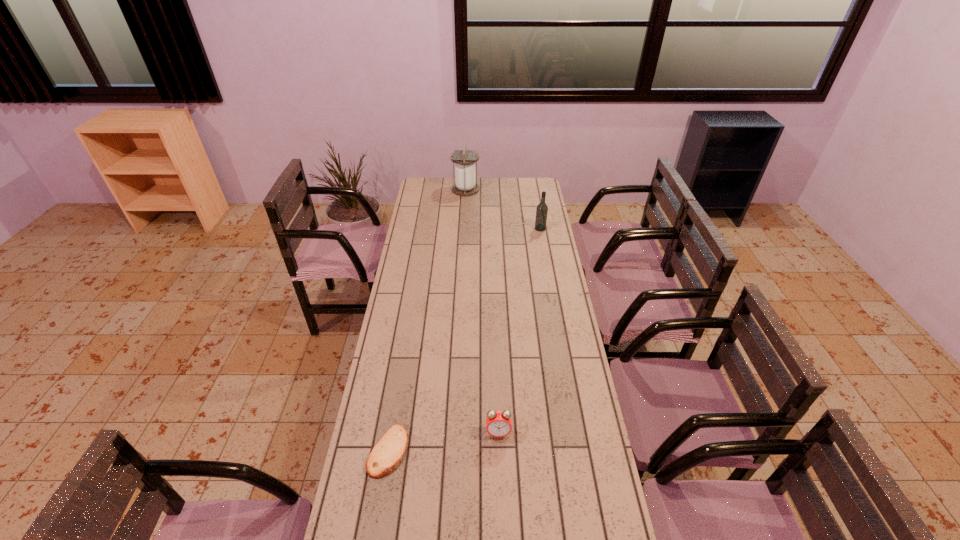
Find the location of a particular element. the closest object to the pita bread is located at coordinates (498, 423).

Identify which object is the closest to the rightmost object. Please provide its 2D coordinates. Your answer should be formatted as a tuple, i.e. [(x, y)], where the tuple contains the x and y coordinates of a point satisfying the conditions above.

[(465, 184)]

Find the location of a particular element. vacant region that satisfies the following two spatial constraints: 1. on the front side of the tallest object; 2. on the left side of the third shortest object is located at coordinates (464, 228).

Where is `vacant area in the image that satisfies the following two spatial constraints: 1. on the front side of the farthest object; 2. on the left side of the third nearest object`? This screenshot has width=960, height=540. vacant area in the image that satisfies the following two spatial constraints: 1. on the front side of the farthest object; 2. on the left side of the third nearest object is located at coordinates (464, 228).

Locate an element on the screen. This screenshot has height=540, width=960. vacant space that satisfies the following two spatial constraints: 1. on the back side of the vodka; 2. on the left side of the leftmost object is located at coordinates (424, 228).